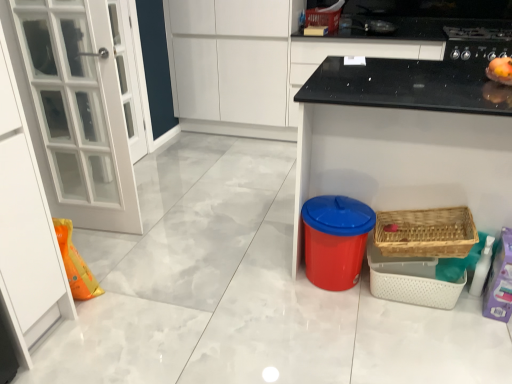
Question: Considering the relative sizes of blue plastic bin at lower right and black glossy stove at upper right, positioned as the second appliance in front-to-back order, in the image provided, is blue plastic bin at lower right shorter than black glossy stove at upper right, positioned as the second appliance in front-to-back order,?

Choices:
 (A) no
 (B) yes

Answer: (A)

Question: Does blue plastic bin at lower right have a greater height compared to black glossy stove at upper right, which ranks as the 1th appliance in right-to-left order?

Choices:
 (A) no
 (B) yes

Answer: (B)

Question: Is blue plastic bin at lower right not within black glossy stove at upper right, positioned as the first appliance in top-to-bottom order?

Choices:
 (A) no
 (B) yes

Answer: (B)

Question: Does blue plastic bin at lower right have a greater width compared to black glossy stove at upper right, which ranks as the 1th appliance in right-to-left order?

Choices:
 (A) yes
 (B) no

Answer: (A)

Question: Does blue plastic bin at lower right have a smaller size compared to black glossy stove at upper right, which ranks as the 2th appliance in left-to-right order?

Choices:
 (A) no
 (B) yes

Answer: (A)

Question: Is blue plastic bin at lower right far from black glossy stove at upper right, which ranks as the 2th appliance in left-to-right order?

Choices:
 (A) yes
 (B) no

Answer: (B)

Question: Is black glossy stove at upper right, positioned as the first appliance in top-to-bottom order, a part of white matte cabinet at upper center?

Choices:
 (A) no
 (B) yes

Answer: (A)

Question: Could you tell me if white matte cabinet at upper center is facing black glossy stove at upper right, positioned as the 2th appliance in bottom-to-top order?

Choices:
 (A) yes
 (B) no

Answer: (B)

Question: Is white matte cabinet at upper center turned away from black glossy stove at upper right, positioned as the 2th appliance in bottom-to-top order?

Choices:
 (A) yes
 (B) no

Answer: (B)

Question: Is white matte cabinet at upper center next to black glossy stove at upper right, positioned as the second appliance in front-to-back order, and touching it?

Choices:
 (A) no
 (B) yes

Answer: (A)

Question: Would you consider white matte cabinet at upper center to be distant from black glossy stove at upper right, positioned as the second appliance in front-to-back order?

Choices:
 (A) no
 (B) yes

Answer: (B)

Question: Can you confirm if white matte cabinet at upper center is wider than black glossy stove at upper right, positioned as the second appliance in front-to-back order?

Choices:
 (A) no
 (B) yes

Answer: (A)

Question: Is woven wood basket at lower right, positioned as the second basket in top-to-bottom order, facing towards blue plastic bin at lower right?

Choices:
 (A) no
 (B) yes

Answer: (B)